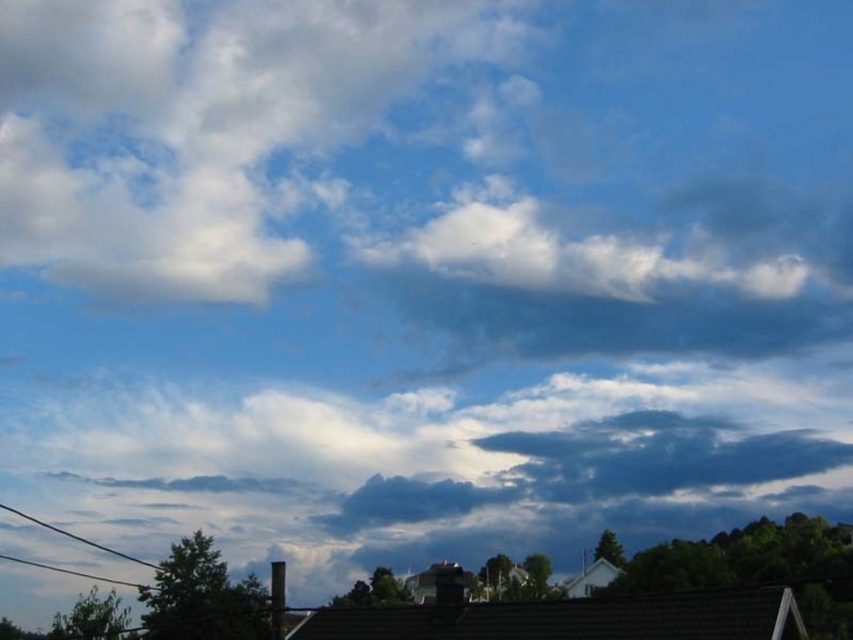
You are standing in the center of the scene and want to move towards the two points marked in the sky. Which point, point (x=119, y=113) or point (x=142, y=563), will you reach first?

Point (x=119, y=113) is closer to you than point (x=142, y=563), so you will reach point (x=119, y=113) first.

You are an airplane pilot preparing for takeoff. You notice the white fluffy cloud at upper center and the black wire at lower left in the distance. Based on their positions, which object is closer to the ground?

The black wire at lower left is closer to the ground since it is positioned below the white fluffy cloud at upper center, which is higher up in the sky.

You are an airplane pilot preparing for takeoff. You notice two objects in the sky ahead of you. The first is a white fluffy cloud at upper center, and the second is a black wire at lower left. According to the scene, which object is positioned to the left when viewed from your perspective?

The white fluffy cloud at upper center is to the left of the black wire at lower left.